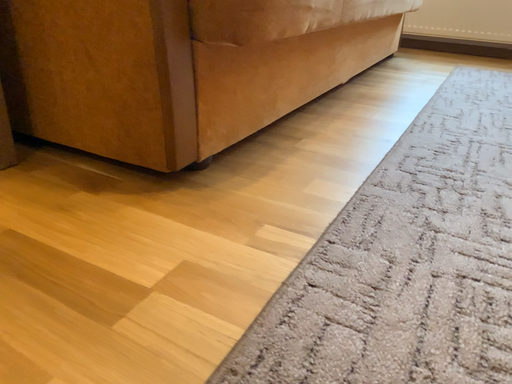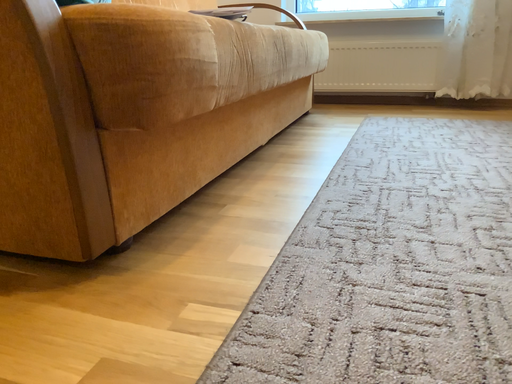
Question: Which way did the camera rotate in the video?

Choices:
 (A) rotated downward
 (B) rotated upward

Answer: (B)